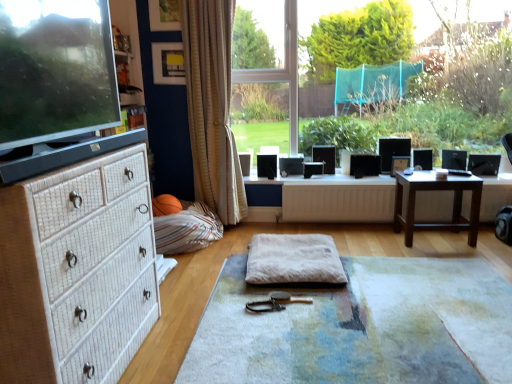
The image size is (512, 384). I want to click on free point in front of brown wooden table at right, so click(460, 254).